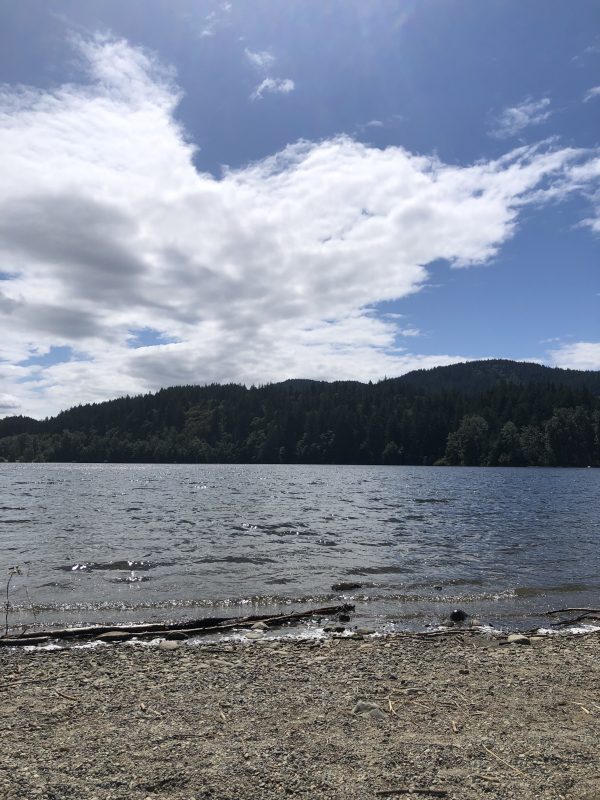
At what (x,y) coordinates should I click in order to perform the action: click on foam. Please return your answer as a coordinate pair (x, y). This screenshot has height=800, width=600. Looking at the image, I should click on (305, 637).